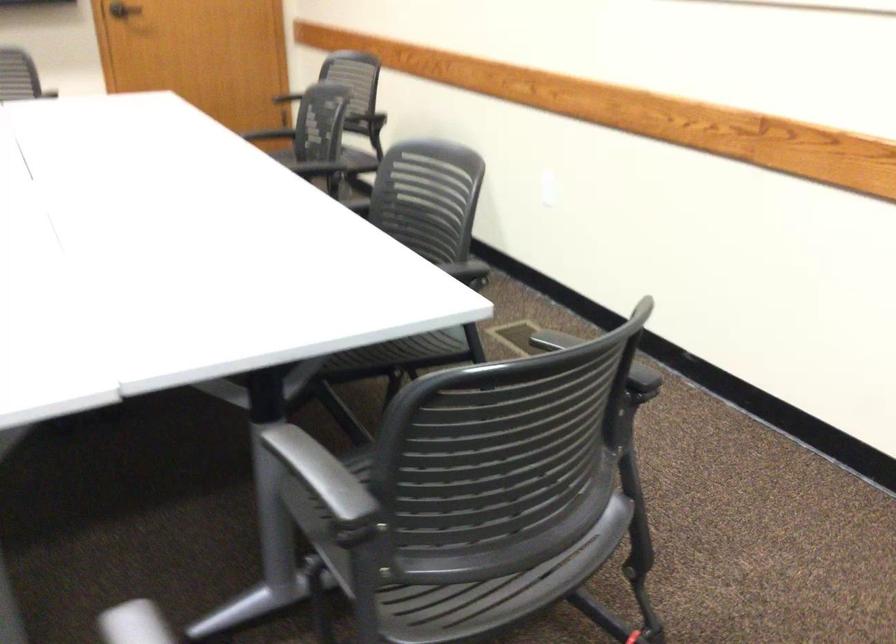
Where would you pull the door handle? Please return your answer as a coordinate pair (x, y).

(123, 10)